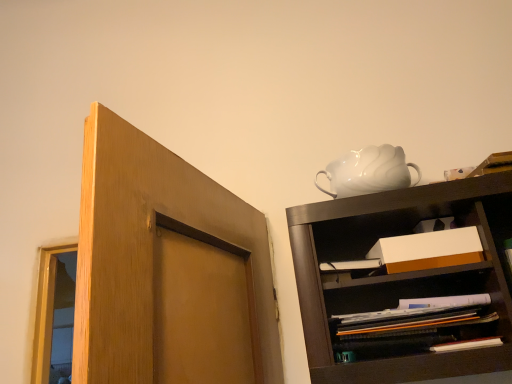
Question: Is white cardboard box at center completely or partially inside matte brown shelf at lower right?

Choices:
 (A) no
 (B) yes

Answer: (A)

Question: From a real-world perspective, is matte brown shelf at lower right below white cardboard box at center?

Choices:
 (A) yes
 (B) no

Answer: (A)

Question: Does matte brown shelf at lower right lie in front of white cardboard box at center?

Choices:
 (A) no
 (B) yes

Answer: (B)

Question: Can you confirm if matte brown shelf at lower right is positioned to the right of white cardboard box at center?

Choices:
 (A) no
 (B) yes

Answer: (B)

Question: Is matte brown shelf at lower right next to white cardboard box at center and touching it?

Choices:
 (A) no
 (B) yes

Answer: (B)

Question: Is matte brown shelf at lower right inside or outside of white glossy teapot at upper right?

Choices:
 (A) outside
 (B) inside

Answer: (A)

Question: From their relative heights in the image, would you say matte brown shelf at lower right is taller or shorter than white glossy teapot at upper right?

Choices:
 (A) tall
 (B) short

Answer: (B)

Question: Is point (510, 316) closer or farther from the camera than point (337, 163)?

Choices:
 (A) farther
 (B) closer

Answer: (B)

Question: From the image's perspective, relative to white glossy teapot at upper right, is matte brown shelf at lower right above or below?

Choices:
 (A) below
 (B) above

Answer: (A)

Question: Does point tap(437, 238) appear closer or farther from the camera than point tap(432, 289)?

Choices:
 (A) closer
 (B) farther

Answer: (A)

Question: Is white cardboard box at center bigger or smaller than matte brown shelf at lower right?

Choices:
 (A) big
 (B) small

Answer: (B)

Question: From the image's perspective, is white cardboard box at center above or below matte brown shelf at lower right?

Choices:
 (A) above
 (B) below

Answer: (A)

Question: In the image, is white cardboard box at center positioned in front of or behind matte brown shelf at lower right?

Choices:
 (A) front
 (B) behind

Answer: (B)

Question: From the image's perspective, is matte brown shelf at lower right positioned above or below white cardboard box at center?

Choices:
 (A) above
 (B) below

Answer: (B)

Question: Based on their sizes in the image, would you say matte brown shelf at lower right is bigger or smaller than white cardboard box at center?

Choices:
 (A) small
 (B) big

Answer: (B)